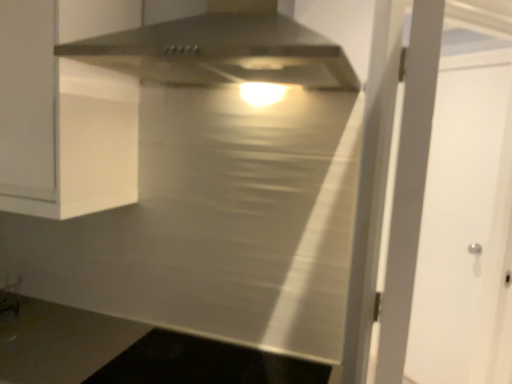
Question: Is white matte door at right taller than stainless steel range hood at upper center?

Choices:
 (A) yes
 (B) no

Answer: (A)

Question: Is stainless steel range hood at upper center a part of white matte door at right?

Choices:
 (A) no
 (B) yes

Answer: (A)

Question: Is white matte door at right at the right side of stainless steel range hood at upper center?

Choices:
 (A) yes
 (B) no

Answer: (A)

Question: Is white matte door at right oriented away from stainless steel range hood at upper center?

Choices:
 (A) yes
 (B) no

Answer: (B)

Question: Is white matte door at right positioned behind stainless steel range hood at upper center?

Choices:
 (A) no
 (B) yes

Answer: (B)

Question: In terms of width, does black glass cooktop at lower center look wider or thinner when compared to white matte door at right?

Choices:
 (A) wide
 (B) thin

Answer: (A)

Question: Is black glass cooktop at lower center in front of or behind white matte door at right in the image?

Choices:
 (A) behind
 (B) front

Answer: (B)

Question: Is point (168, 344) positioned closer to the camera than point (500, 160)?

Choices:
 (A) farther
 (B) closer

Answer: (B)

Question: Which is correct: black glass cooktop at lower center is inside white matte door at right, or outside of it?

Choices:
 (A) outside
 (B) inside

Answer: (A)

Question: Do you think black glass cooktop at lower center is within stainless steel range hood at upper center, or outside of it?

Choices:
 (A) outside
 (B) inside

Answer: (A)

Question: Does point (232, 357) appear closer or farther from the camera than point (224, 49)?

Choices:
 (A) closer
 (B) farther

Answer: (B)

Question: Considering their positions, is black glass cooktop at lower center located in front of or behind stainless steel range hood at upper center?

Choices:
 (A) front
 (B) behind

Answer: (B)

Question: From a real-world perspective, is black glass cooktop at lower center positioned above or below stainless steel range hood at upper center?

Choices:
 (A) below
 (B) above

Answer: (A)

Question: Considering the positions of point (435, 266) and point (228, 354), is point (435, 266) closer or farther from the camera than point (228, 354)?

Choices:
 (A) farther
 (B) closer

Answer: (A)

Question: From their relative heights in the image, would you say white matte door at right is taller or shorter than black glass cooktop at lower center?

Choices:
 (A) short
 (B) tall

Answer: (B)